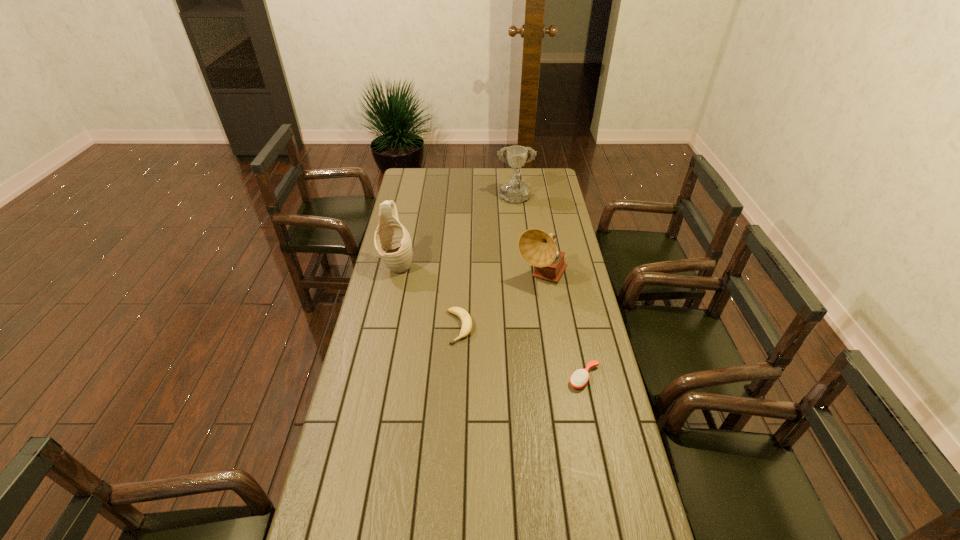
Locate an element on the screen. pitcher is located at coordinates (392, 241).

This screenshot has width=960, height=540. What are the coordinates of `award` in the screenshot? It's located at coord(514,192).

Where is `phonograph record`? phonograph record is located at coordinates (538, 248).

The width and height of the screenshot is (960, 540). What are the coordinates of `hairbrush` in the screenshot? It's located at (580, 377).

The width and height of the screenshot is (960, 540). In order to click on the fourth object from right to left in this screenshot , I will do `click(466, 320)`.

Find the location of a particular element. The image size is (960, 540). banana is located at coordinates (466, 320).

Find the location of a particular element. vacant region located at the spout of the leftmost object is located at coordinates (389, 309).

Find the location of `vacant region located 0.300m on the side with emblem of the farthest object`. vacant region located 0.300m on the side with emblem of the farthest object is located at coordinates (520, 248).

Locate an element on the screen. This screenshot has height=540, width=960. blank space located 0.360m on the horn of the phonograph record is located at coordinates (556, 367).

Identify the location of vacant space located 0.120m on the left of the nearest object. (532, 377).